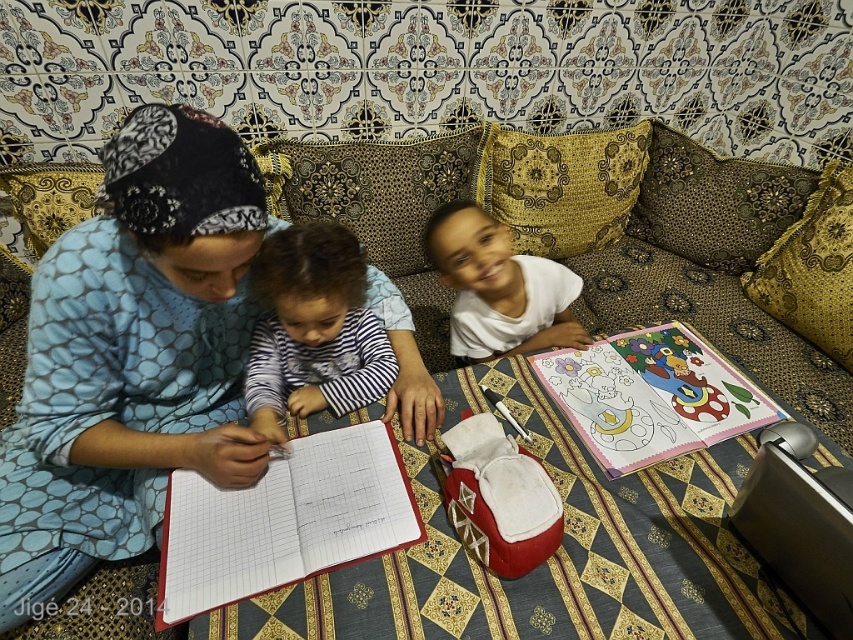
Question: Among these objects, which one is farthest from the camera?

Choices:
 (A) pastel paper coloring book at center
 (B) red leather notebook at center
 (C) blue dotted dress at center

Answer: (A)

Question: Can you confirm if pastel paper coloring book at center is thinner than white matte shirt at center?

Choices:
 (A) yes
 (B) no

Answer: (B)

Question: Is red leather notebook at center wider than pastel paper coloring book at center?

Choices:
 (A) yes
 (B) no

Answer: (B)

Question: Does striped fabric shirt at center appear on the left side of white matte shirt at center?

Choices:
 (A) yes
 (B) no

Answer: (A)

Question: Estimate the real-world distances between objects in this image. Which object is closer to the red leather notebook at center?

Choices:
 (A) pastel paper coloring book at center
 (B) blue dotted dress at center
 (C) white matte shirt at center

Answer: (B)

Question: Which of the following is the farthest from the observer?

Choices:
 (A) click(648, 336)
 (B) click(349, 273)

Answer: (A)